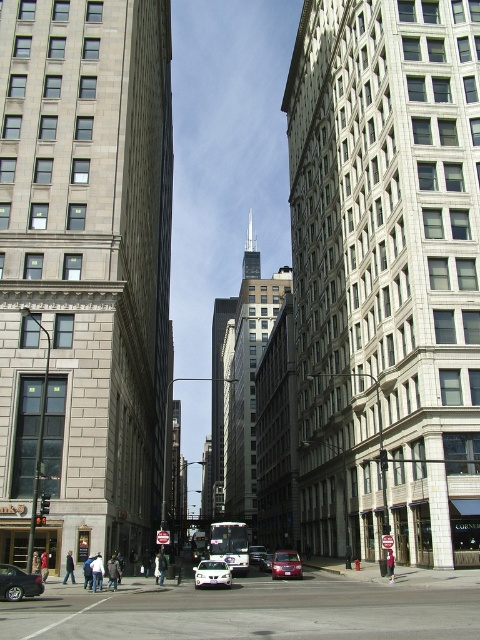
Question: Is the position of black glass skyscraper at center less distant than that of shiny silver sedan at lower left?

Choices:
 (A) yes
 (B) no

Answer: (B)

Question: Which point is closer to the camera?

Choices:
 (A) 232,390
 (B) 74,29
 (C) 411,442
 (D) 299,556

Answer: (C)

Question: Which of the following is the closest to the observer?

Choices:
 (A) (265, 564)
 (B) (17, 572)
 (C) (250, 554)
 (D) (219, 474)

Answer: (B)

Question: Among these objects, which one is farthest from the camera?

Choices:
 (A) black glass skyscraper at center
 (B) metallic red sedan at center
 (C) white stone building at center

Answer: (A)

Question: Where is white stone building at center located in relation to metallic silver sedan at center in the image?

Choices:
 (A) above
 (B) below

Answer: (A)

Question: Is white glossy sedan at center positioned at the back of metallic silver sedan at center?

Choices:
 (A) yes
 (B) no

Answer: (B)